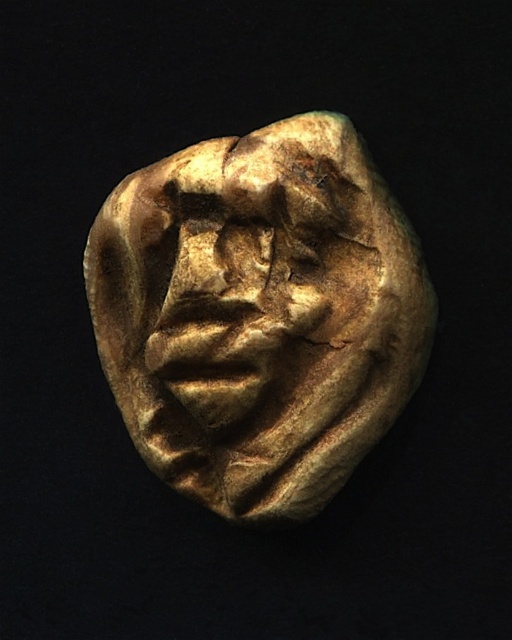
Question: Which point appears farthest from the camera in this image?

Choices:
 (A) 306,198
 (B) 241,240

Answer: (B)

Question: Is gold textured mask at center wider than golden textured mask at center?

Choices:
 (A) no
 (B) yes

Answer: (B)

Question: Which object is farther from the camera taking this photo?

Choices:
 (A) golden textured mask at center
 (B) gold textured mask at center

Answer: (B)

Question: Can you confirm if gold textured mask at center is positioned to the right of golden textured mask at center?

Choices:
 (A) no
 (B) yes

Answer: (B)

Question: In this image, where is gold textured mask at center located relative to golden textured mask at center?

Choices:
 (A) left
 (B) right

Answer: (B)